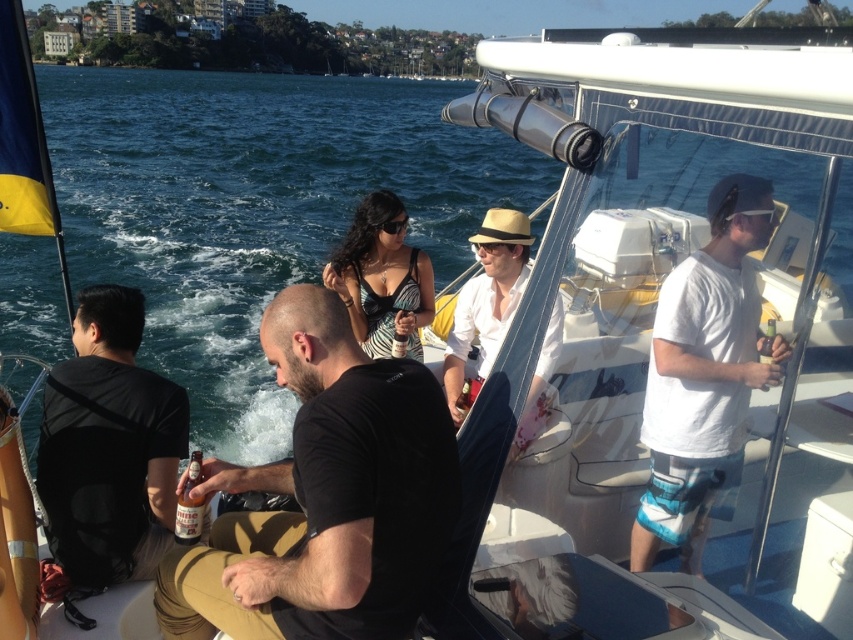
You are a photographer on the boat and want to take a photo of the matte straw hat at center and the zebra print dress at center. Which object is positioned lower in the frame?

The matte straw hat at center is located below the zebra print dress at center, so it is positioned lower in the frame.